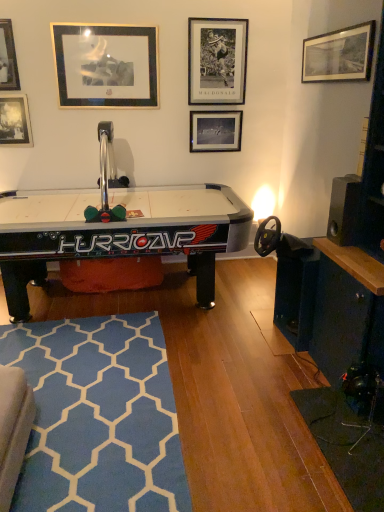
The height and width of the screenshot is (512, 384). What are the coordinates of `free point to the right of blue textured rug at lower left` in the screenshot? It's located at (233, 394).